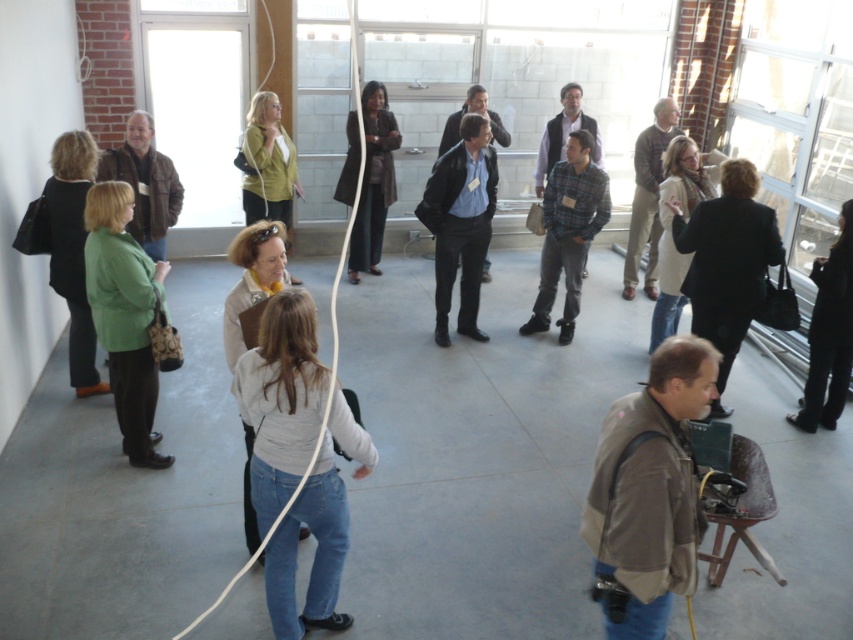
You are standing in the construction site and want to move from the point at coordinates point (76, 228) to the point at coordinates point (666, 266). Which direction should you move in to get closer to your destination?

To move from point (76, 228) to point (666, 266), you should move upward and to the right since point (666, 266) is farther from the camera compared to point (76, 228), indicating it is located in a direction that is both upward and to the right in the image plane.

You are a delivery person carrying a package that requires a 2 meter clearance to maneuver safely. You need to move from the entrance to the green matte jacket at left and dark brown leather jacket at center. Is there enough space between them to navigate safely?

The green matte jacket at left is 3.19 meters away from the dark brown leather jacket at center, so yes, there is enough space between them to navigate safely with a 2 meter clearance requirement.

You are navigating through a construction site and need to reach a specific location. You see two reference points marked as point (267, 172) and point (354, 204). Which point is closer to you?

Point (267, 172) is closer to you because it is further to the viewer than point (354, 204).